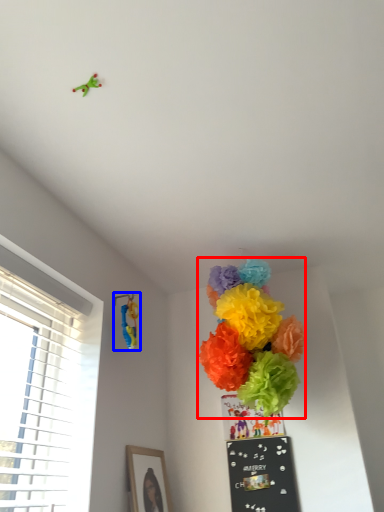
Question: Which object appears farthest to the camera in this image, flower (highlighted by a red box) or toy (highlighted by a blue box)?

Choices:
 (A) flower
 (B) toy

Answer: (B)